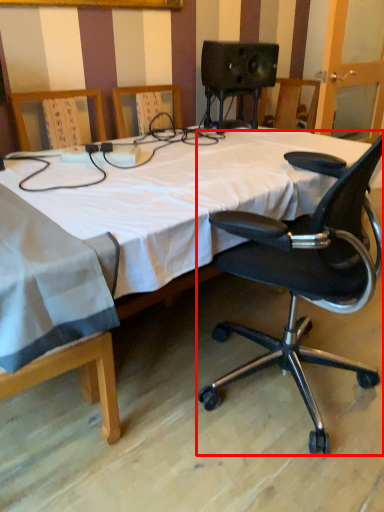
Question: Observing the image, what is the correct spatial positioning of chair (annotated by the red box) in reference to bed?

Choices:
 (A) right
 (B) left

Answer: (A)